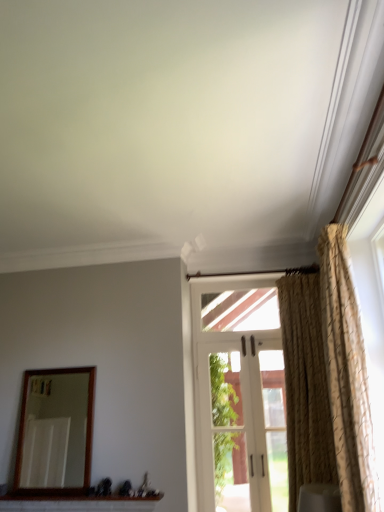
Question: From a real-world perspective, is white brick window sill at lower center physically located above or below gold textured curtain at right, which appears as the 2th curtain when viewed from the back?

Choices:
 (A) below
 (B) above

Answer: (A)

Question: Considering the positions of white brick window sill at lower center and gold textured curtain at right, positioned as the 1th curtain in front-to-back order, in the image, is white brick window sill at lower center bigger or smaller than gold textured curtain at right, positioned as the 1th curtain in front-to-back order,?

Choices:
 (A) big
 (B) small

Answer: (B)

Question: Which of these objects is positioned closest to the white brick window sill at lower center?

Choices:
 (A) beige textured curtain at right, which is the 2th curtain from front to back
 (B) white fabric curtain at right
 (C) gold textured curtain at right, positioned as the 1th curtain in front-to-back order
 (D) wooden-framed mirror at left

Answer: (D)

Question: Considering the real-world distances, which object is closest to the beige textured curtain at right, which is the 2th curtain from front to back?

Choices:
 (A) gold textured curtain at right, positioned as the 1th curtain in front-to-back order
 (B) white brick window sill at lower center
 (C) white fabric curtain at right
 (D) wooden-framed mirror at left

Answer: (A)